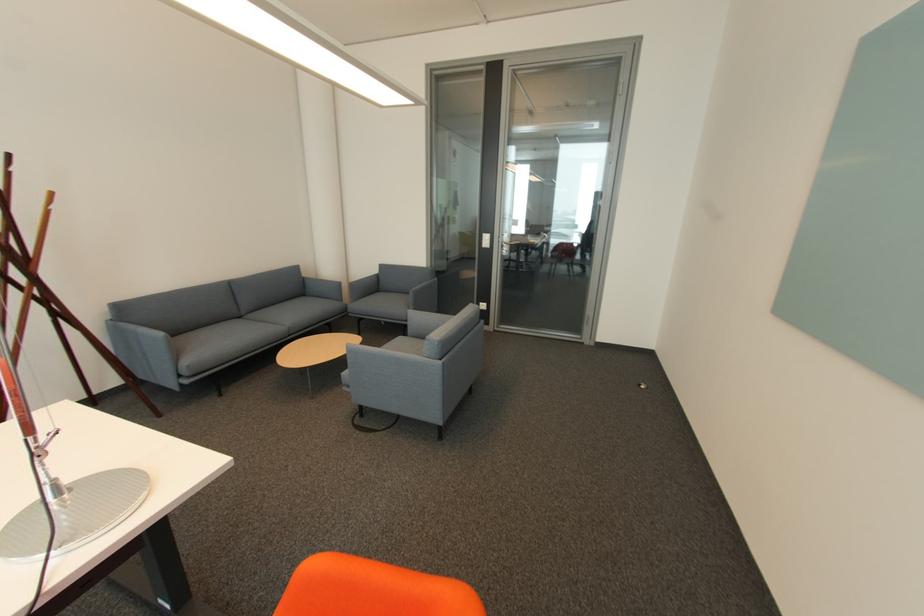
Describe the element at coordinates (381, 301) in the screenshot. I see `the grey chair sitting surface` at that location.